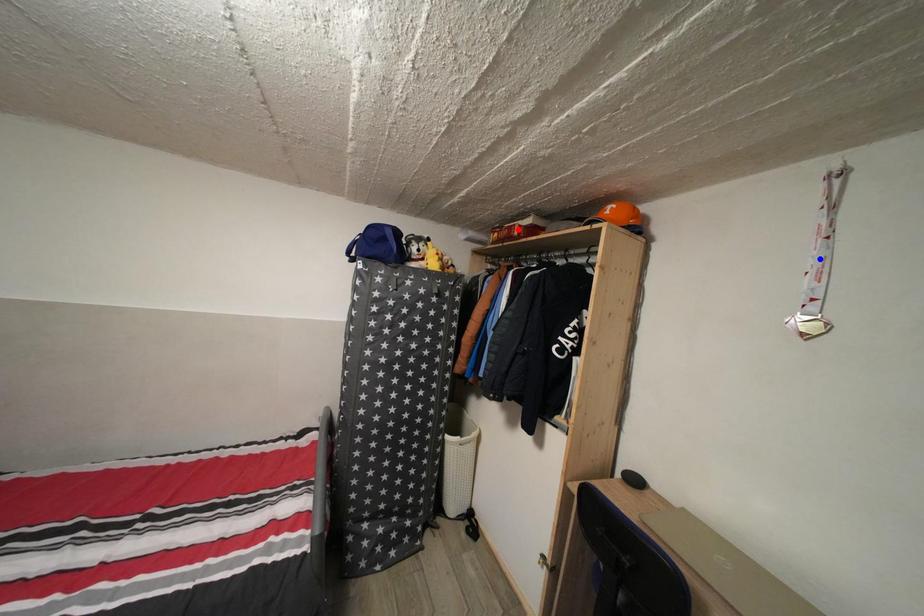
Question: Which of the two points in the image is closer to the camera?

Choices:
 (A) Blue point is closer.
 (B) Red point is closer.

Answer: (A)